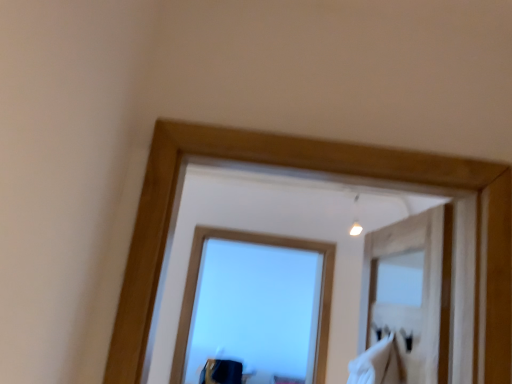
From the picture: Measure the distance between point (297, 248) and camera.

9.28 feet.

The image size is (512, 384). Describe the element at coordinates (255, 243) in the screenshot. I see `transparent glass window at upper center` at that location.

Identify the location of transparent glass window at upper center. This screenshot has width=512, height=384. (255, 243).

Image resolution: width=512 pixels, height=384 pixels. Identify the location of transparent glass window at upper center. (255, 243).